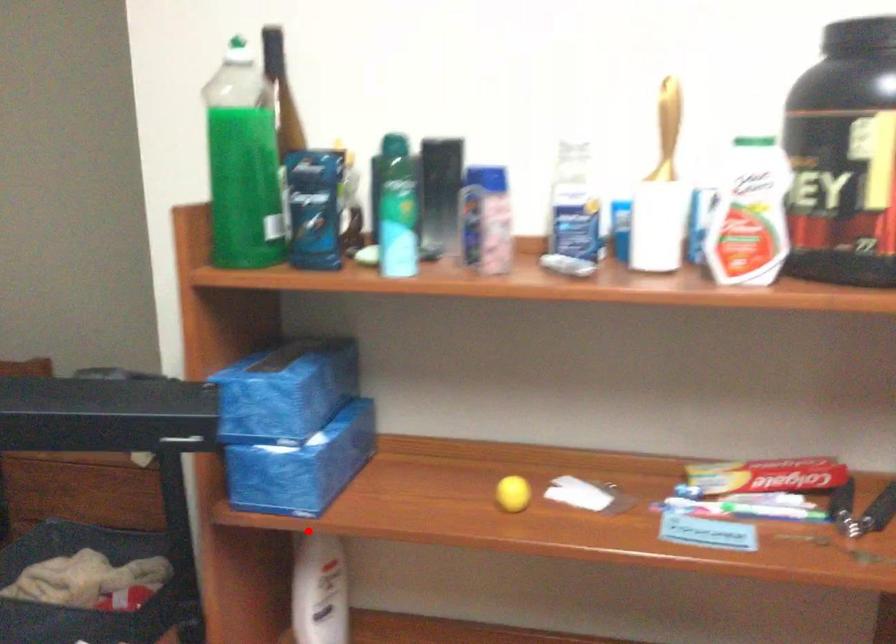
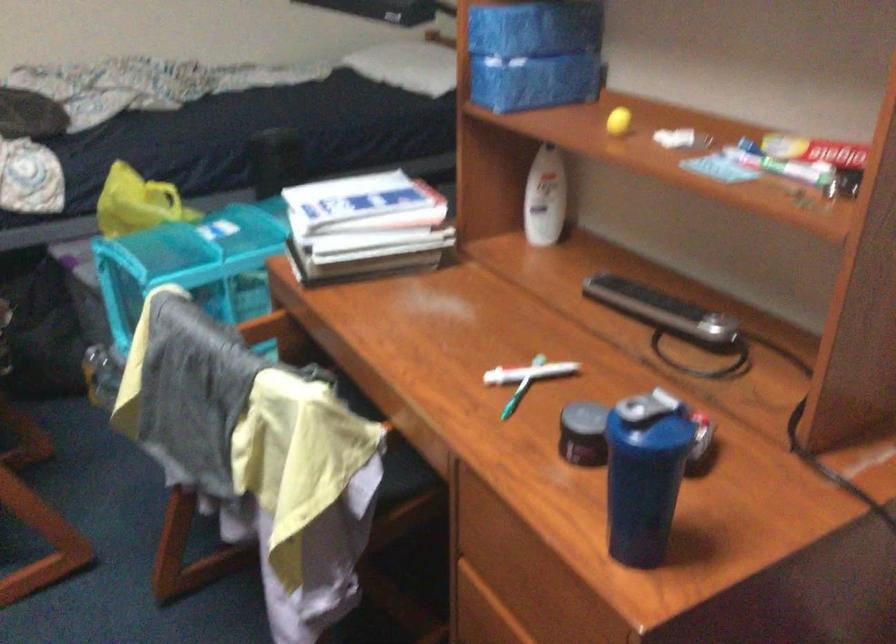
Question: I am providing you with two images of the same scene from different viewpoints. Given a red point in image1, look at the same physical point in image2. Is it:

Choices:
 (A) Closer to the viewpoint
 (B) Farther from the viewpoint

Answer: (B)